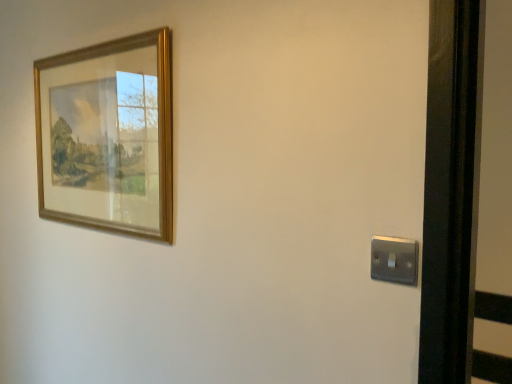
Question: Could you tell me if satin silver switch at lower right is facing wooden picture frame at upper left?

Choices:
 (A) yes
 (B) no

Answer: (B)

Question: Is wooden picture frame at upper left inside satin silver switch at lower right?

Choices:
 (A) yes
 (B) no

Answer: (B)

Question: Can you confirm if satin silver switch at lower right is bigger than wooden picture frame at upper left?

Choices:
 (A) yes
 (B) no

Answer: (B)

Question: From a real-world perspective, is satin silver switch at lower right positioned under wooden picture frame at upper left based on gravity?

Choices:
 (A) no
 (B) yes

Answer: (B)

Question: From the image's perspective, is satin silver switch at lower right located above wooden picture frame at upper left?

Choices:
 (A) yes
 (B) no

Answer: (B)

Question: Is satin silver switch at lower right smaller than wooden picture frame at upper left?

Choices:
 (A) yes
 (B) no

Answer: (A)

Question: From the image's perspective, is wooden picture frame at upper left above satin silver switch at lower right?

Choices:
 (A) yes
 (B) no

Answer: (A)

Question: Is satin silver switch at lower right surrounded by wooden picture frame at upper left?

Choices:
 (A) yes
 (B) no

Answer: (B)

Question: Can you confirm if wooden picture frame at upper left is positioned to the left of satin silver switch at lower right?

Choices:
 (A) no
 (B) yes

Answer: (B)

Question: Is wooden picture frame at upper left wider than satin silver switch at lower right?

Choices:
 (A) yes
 (B) no

Answer: (A)

Question: Does wooden picture frame at upper left have a lesser width compared to satin silver switch at lower right?

Choices:
 (A) yes
 (B) no

Answer: (B)

Question: Can you confirm if wooden picture frame at upper left is bigger than satin silver switch at lower right?

Choices:
 (A) no
 (B) yes

Answer: (B)

Question: In the image, is wooden picture frame at upper left positioned in front of or behind satin silver switch at lower right?

Choices:
 (A) behind
 (B) front

Answer: (A)